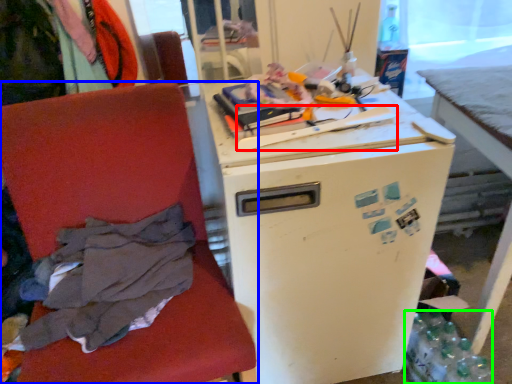
Question: Estimate the real-world distances between objects in this image. Which object is closer to equipment (highlighted by a red box), chair (highlighted by a blue box) or bottle (highlighted by a green box)?

Choices:
 (A) chair
 (B) bottle

Answer: (A)